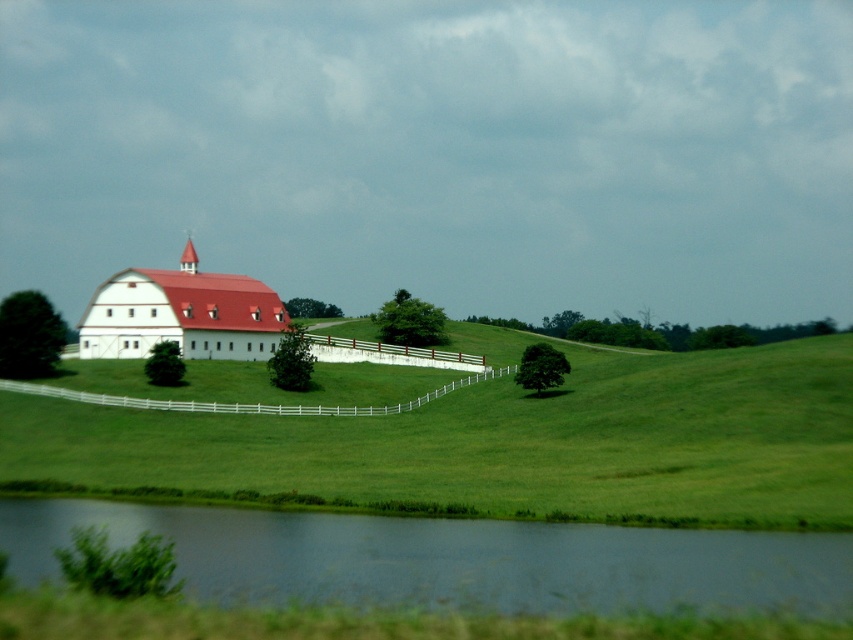
You are standing in the middle of the rural landscape looking at the barn and the surrounding area. There are two points marked in the image. Which point, point (364, 563) or point (219, 285), is closer to you?

Point (364, 563) is closer to the viewer than point (219, 285).

You are standing at the edge of the smooth reflective water at lower center. You want to walk to the large white barn with a red roof on the hill. Which direction should you head towards?

The large white barn with a red roof is situated on a gently sloping hill behind the smooth reflective water at lower center. Since you are at the water, you should head towards the direction of the hill to reach the barn.

You are standing at the edge of the smooth reflective water at lower center and want to walk to the white wooden fence at center. Which direction should you head to reach the fence?

Since the smooth reflective water at lower center is closer to the viewer than the white wooden fence at center, you should walk towards the direction away from the viewer to reach the fence.